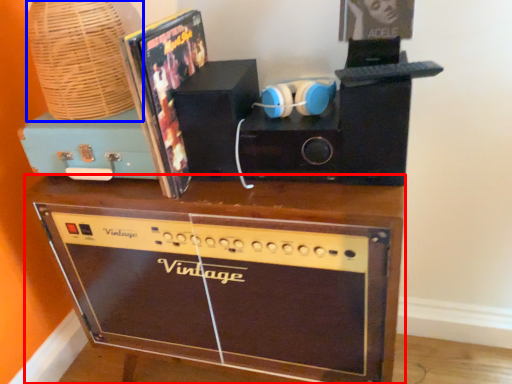
Question: Which object is further to the camera taking this photo, furniture (highlighted by a red box) or basket (highlighted by a blue box)?

Choices:
 (A) furniture
 (B) basket

Answer: (B)